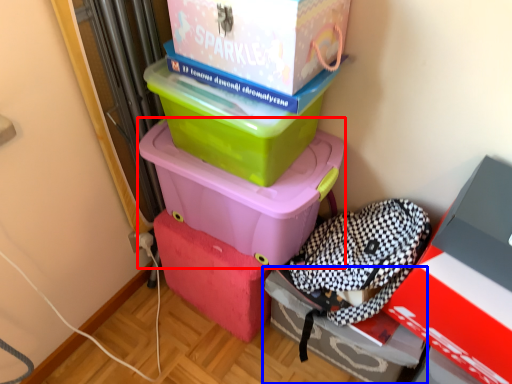
Question: Which object is closer to the camera taking this photo, box (highlighted by a red box) or box (highlighted by a blue box)?

Choices:
 (A) box
 (B) box

Answer: (A)